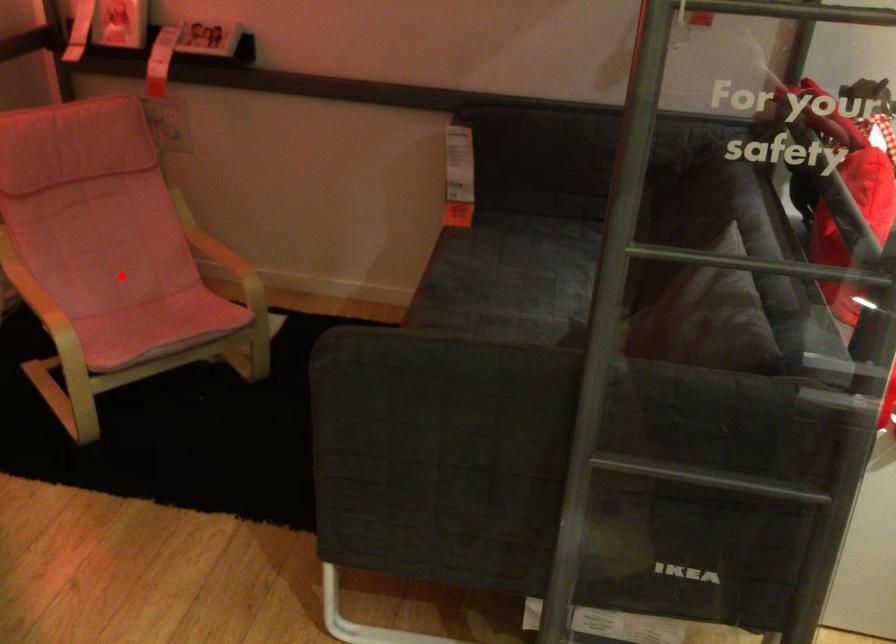
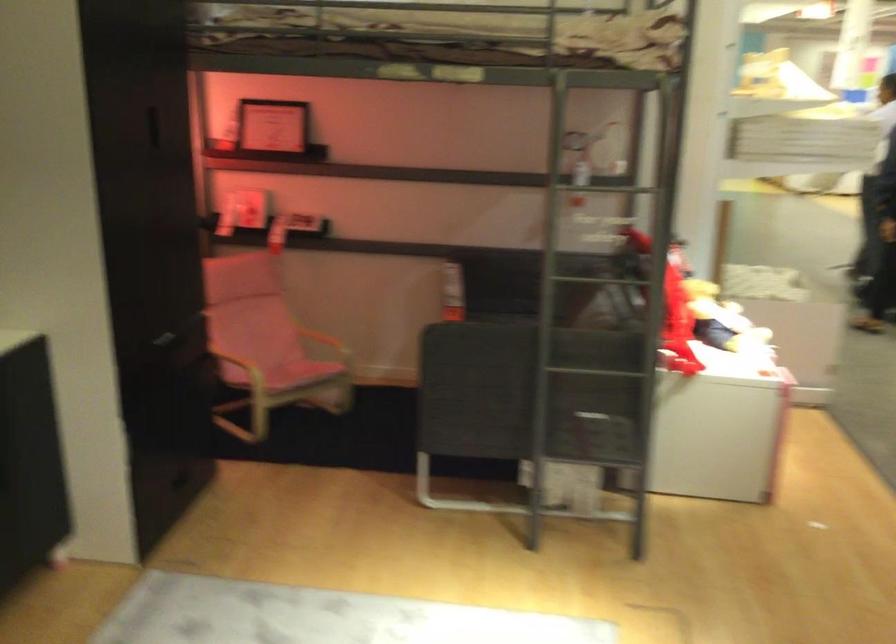
Where in the second image is the point corresponding to the highlighted location from the first image?

(268, 353)